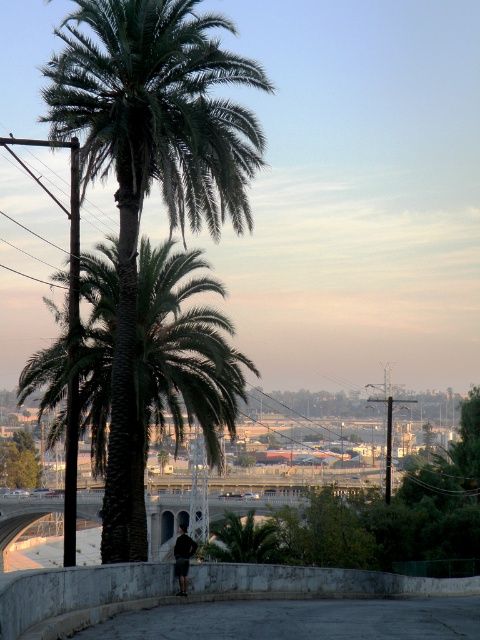
You are standing at the base of the palm tree and notice a concrete ledge at lower center and dark gray fabric pants at center. Which object is positioned higher in the scene?

The concrete ledge at lower center is located above the dark gray fabric pants at center, so it is positioned higher in the scene.

Consider the image. You are a painter setting up an easel to paint the scene. You want to ensure the green leafy palm tree at center and the concrete ledge at lower center are both visible in your painting. Based on their widths, which object should you focus on positioning closer to the center of your canvas?

The green leafy palm tree at center might be wider than the concrete ledge at lower center, so you should position the green leafy palm tree at center closer to the center of the canvas to ensure it is fully visible.

You are standing at the point marked as point (151, 172) in the image. Looking around, you see a palm tree and the cityscape in the background. Which object is closer to you at that point?

The point (151, 172) is on the green leafy palm tree at center, so the palm tree is closer to you than the cityscape in the background.